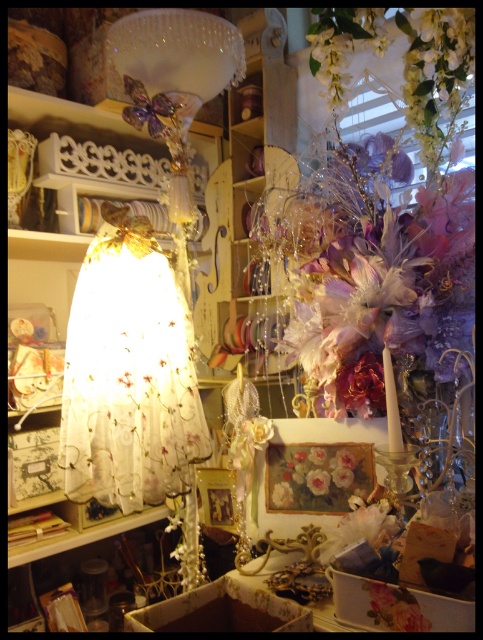
You are standing in the vintage craft room and want to place a small decoration between the two points, point 1 at point (325,497) and point 2 at point (245,429). Which point should you place it closer to if you want the decoration to be more visible to someone entering the room?

You should place the decoration closer to point 1 at point (325,497) because it is closer to the viewer, making the decoration more visible to someone entering the room.

You are standing in the vintage craft room and want to place a small decoration on the translucent fabric lampshade at left. The point where you want to place it is at coordinates point (x=54, y=241). Is this point on the lampshade?

Yes, the point (x=54, y=241) is on the translucent fabric lampshade at left according to the description.

You are a customer in a shop and want to touch both the translucent fabric lampshade at left and the white lace lampshade at upper center. Which lampshade will you reach first?

You will reach the translucent fabric lampshade at left first because it is closer to you than the white lace lampshade at upper center, which is further away.